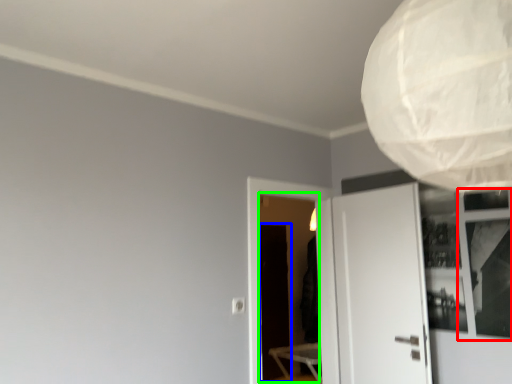
Question: Considering the real-world distances, which object is closest to window (highlighted by a red box)? screen door (highlighted by a blue box) or screen door (highlighted by a green box).

Choices:
 (A) screen door
 (B) screen door

Answer: (A)